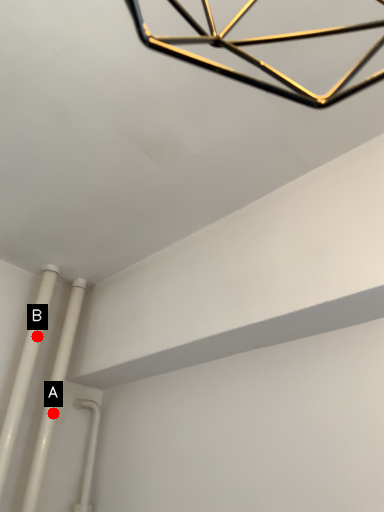
Question: Two points are circled on the image, labeled by A and B beside each circle. Which point is farther from the camera taking this photo?

Choices:
 (A) A is further
 (B) B is further

Answer: (A)